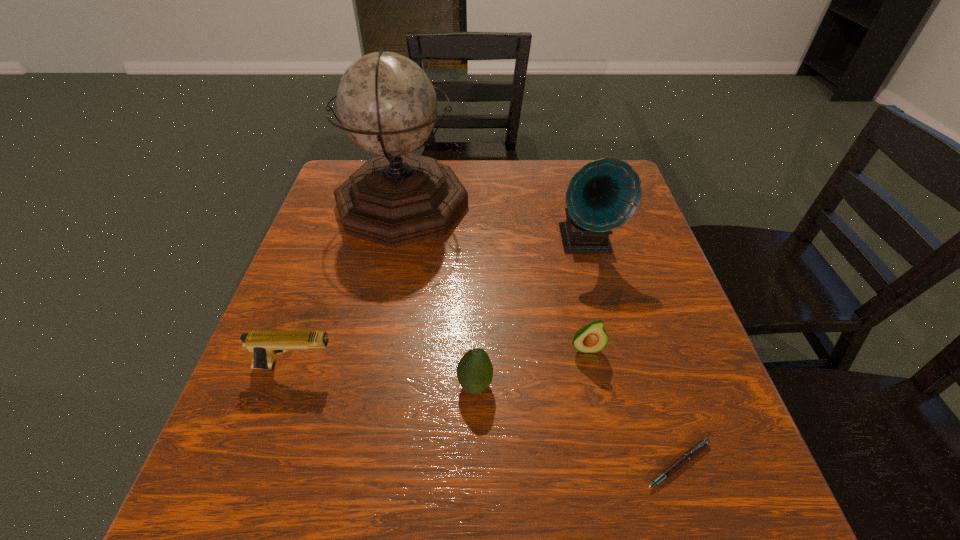
Locate an element on the screen. object that is positioned at the near right corner is located at coordinates (692, 452).

This screenshot has height=540, width=960. In the image, there is a desktop. Find the location of `vacant space at the far edge`. vacant space at the far edge is located at coordinates (530, 177).

At what (x,y) coordinates should I click in order to perform the action: click on free region at the left edge of the desktop. Please return your answer as a coordinate pair (x, y). Looking at the image, I should click on (279, 434).

I want to click on vacant space at the right edge of the desktop, so click(637, 351).

At what (x,y) coordinates should I click in order to perform the action: click on blank space at the far left corner of the desktop. Please return your answer as a coordinate pair (x, y). This screenshot has height=540, width=960. Looking at the image, I should click on (348, 173).

Locate an element on the screen. This screenshot has width=960, height=540. vacant area at the near right corner is located at coordinates (702, 507).

Locate an element on the screen. The height and width of the screenshot is (540, 960). free spot between the third farthest object and the pistol is located at coordinates (441, 357).

Find the location of a particular element. Image resolution: width=960 pixels, height=540 pixels. blank region between the phonograph_record and the globe is located at coordinates (493, 223).

Find the location of a particular element. The image size is (960, 540). vacant space that's between the farther avocado and the left avocado is located at coordinates (531, 367).

You are a GUI agent. You are given a task and a screenshot of the screen. Output one action in this format:
    pyautogui.click(x=<x>, y=<y>)
    Task: Click on the vacant space that is in between the pistol and the globe
    This screenshot has width=960, height=540.
    Given the screenshot: What is the action you would take?
    pyautogui.click(x=349, y=286)